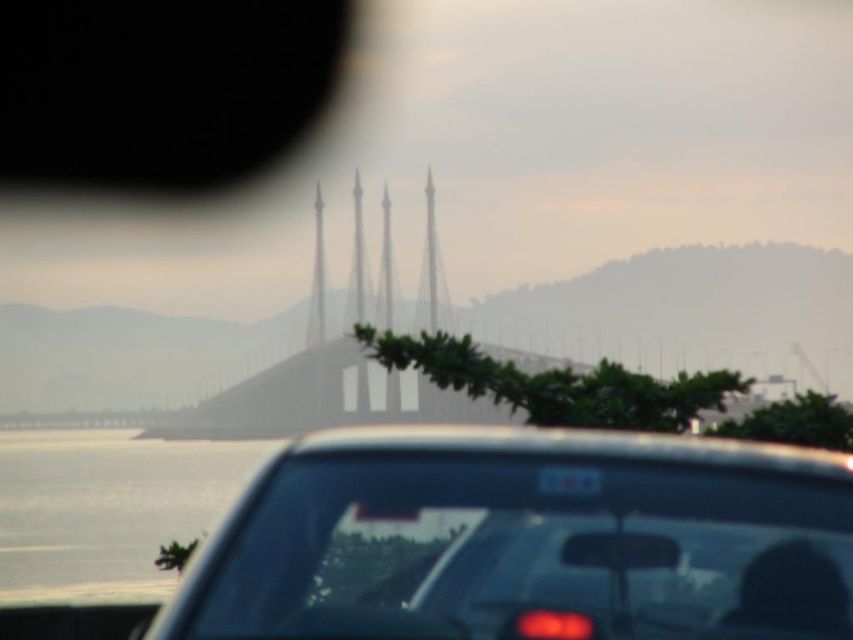
Question: Which point is closer to the camera?

Choices:
 (A) black plastic license plate at center
 (B) clear water at lower left

Answer: (A)

Question: Which point is farther from the camera taking this photo?

Choices:
 (A) pyautogui.click(x=596, y=476)
 (B) pyautogui.click(x=202, y=451)
 (C) pyautogui.click(x=822, y=548)

Answer: (B)

Question: Among these points, which one is nearest to the camera?

Choices:
 (A) (585, 474)
 (B) (201, 465)
 (C) (691, 589)

Answer: (C)

Question: In this image, where is matte black car at center located relative to clear water at lower left?

Choices:
 (A) left
 (B) right

Answer: (B)

Question: Is clear water at lower left to the left of black plastic license plate at center from the viewer's perspective?

Choices:
 (A) no
 (B) yes

Answer: (B)

Question: Is clear water at lower left positioned at the back of black plastic license plate at center?

Choices:
 (A) no
 (B) yes

Answer: (B)